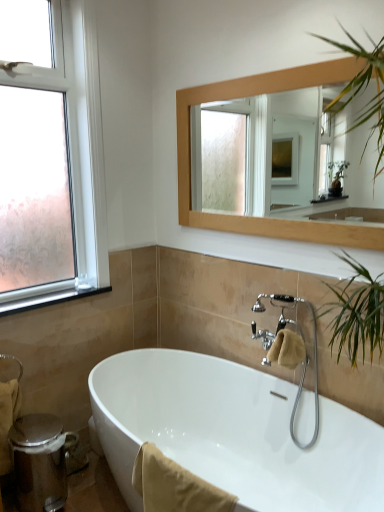
Find the location of `empty space that is ontop of wooden frame mirror at upper center (from a real-world perspective)`. empty space that is ontop of wooden frame mirror at upper center (from a real-world perspective) is located at coordinates (268, 72).